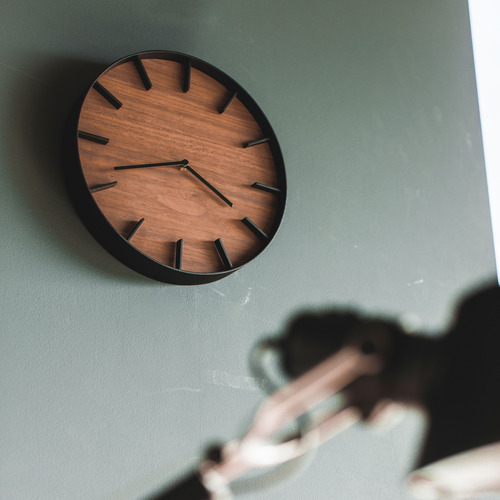
Where is `hour hand on clock`? The height and width of the screenshot is (500, 500). hour hand on clock is located at coordinates (146, 165).